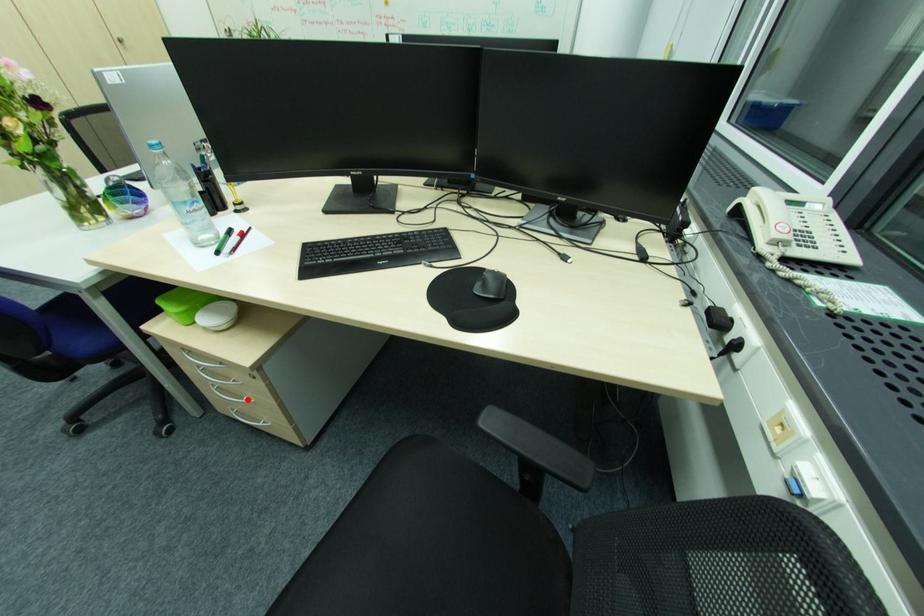
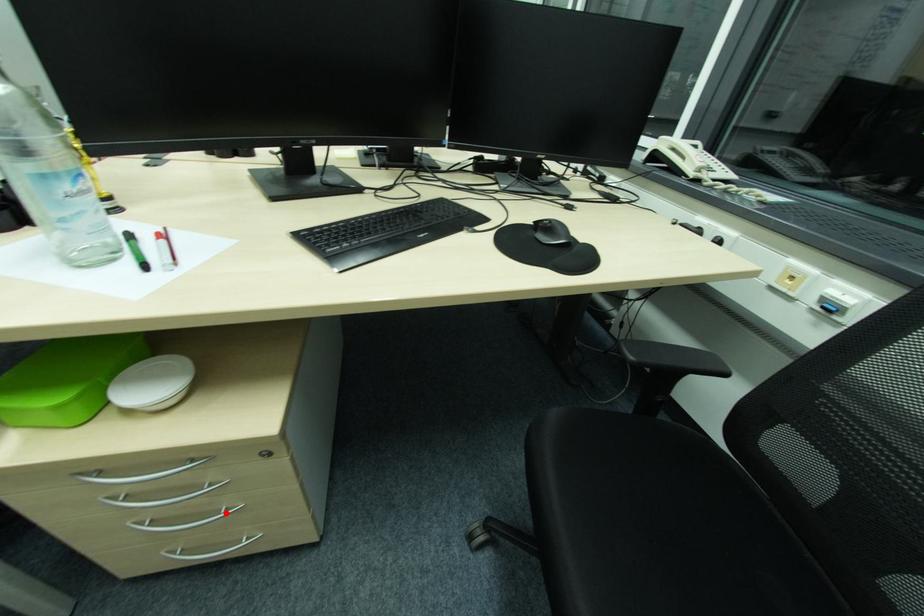
I am providing you with two images of the same scene from different viewpoints. A red point is marked on the first image and another point is marked on the second image. Do the highlighted points in image1 and image2 indicate the same real-world spot?

Yes